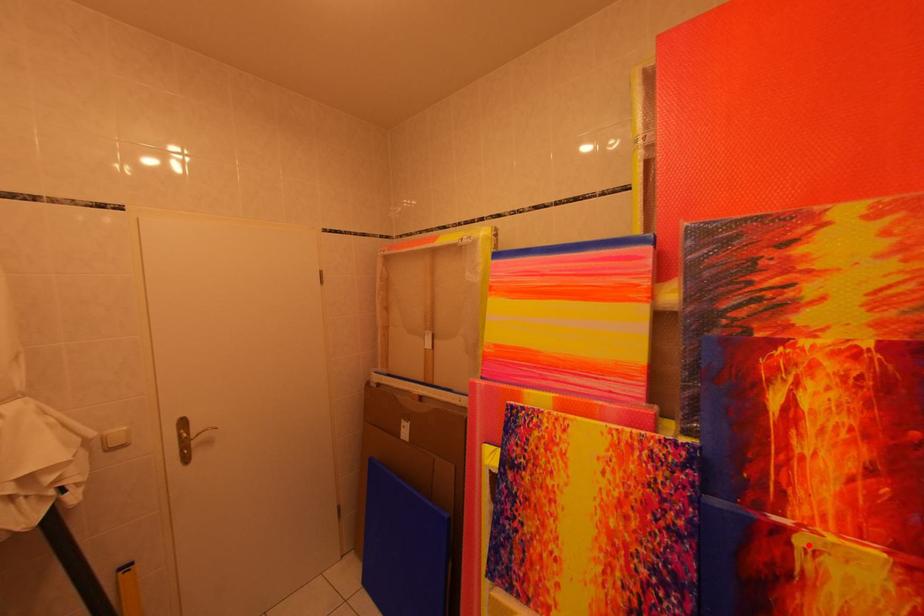
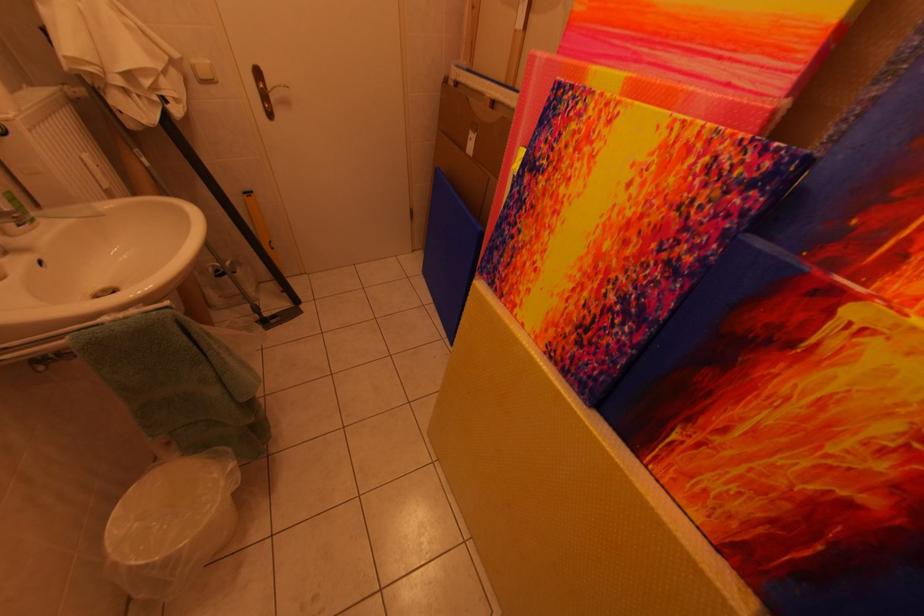
Question: I am providing you with two images of the same scene from different viewpoints. A red point is marked on the first image. Can you still see the location of the red point in image 2?

Choices:
 (A) Yes
 (B) No

Answer: (A)